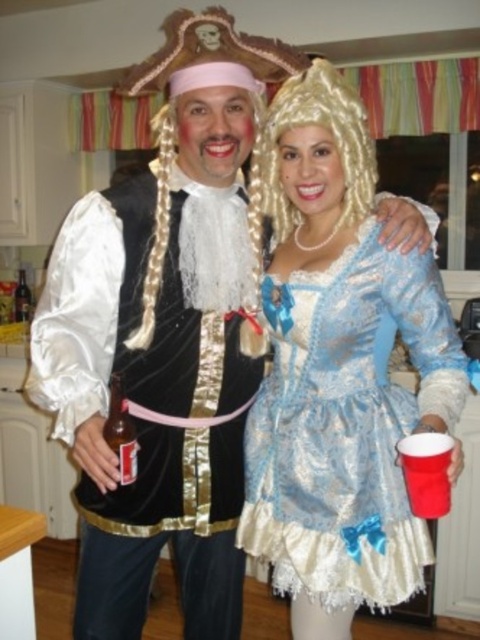
Is shiny blue satin dress at center wider than blonde synthetic wig at upper center?

Yes.

Locate an element on the screen. This screenshot has width=480, height=640. shiny blue satin dress at center is located at coordinates (347, 426).